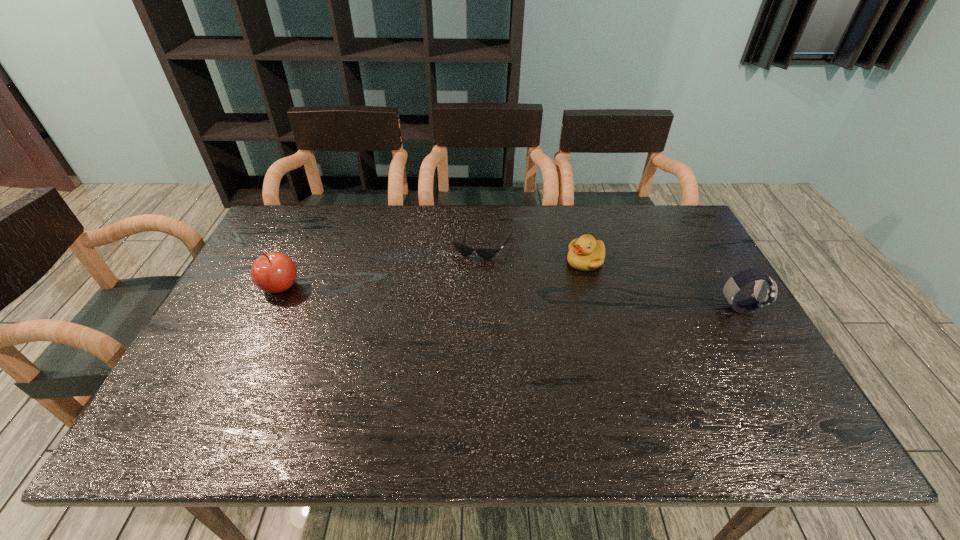
Locate an element on the screen. This screenshot has height=540, width=960. vacant space at the far left corner is located at coordinates (299, 243).

In the image, there is a desktop. Identify the location of free space at the far right corner. This screenshot has width=960, height=540. (670, 221).

Where is `free spot between the second shortest object and the rightmost object`? The image size is (960, 540). free spot between the second shortest object and the rightmost object is located at coordinates (662, 285).

Where is `vacant point located between the rightmost object and the apple`? vacant point located between the rightmost object and the apple is located at coordinates (510, 297).

Locate an element on the screen. This screenshot has width=960, height=540. empty space between the apple and the sunglasses is located at coordinates (382, 264).

At what (x,y) coordinates should I click in order to perform the action: click on unoccupied area between the apple and the rightmost object. Please return your answer as a coordinate pair (x, y). The image size is (960, 540). Looking at the image, I should click on (510, 297).

Identify the location of free space that is in between the rightmost object and the sunglasses. (612, 275).

Identify the location of empty space between the shortest object and the watch. This screenshot has width=960, height=540. (612, 275).

Locate an element on the screen. The width and height of the screenshot is (960, 540). unoccupied position between the leftmost object and the sunglasses is located at coordinates (382, 264).

Find the location of a particular element. The image size is (960, 540). empty space that is in between the third tallest object and the sunglasses is located at coordinates (535, 252).